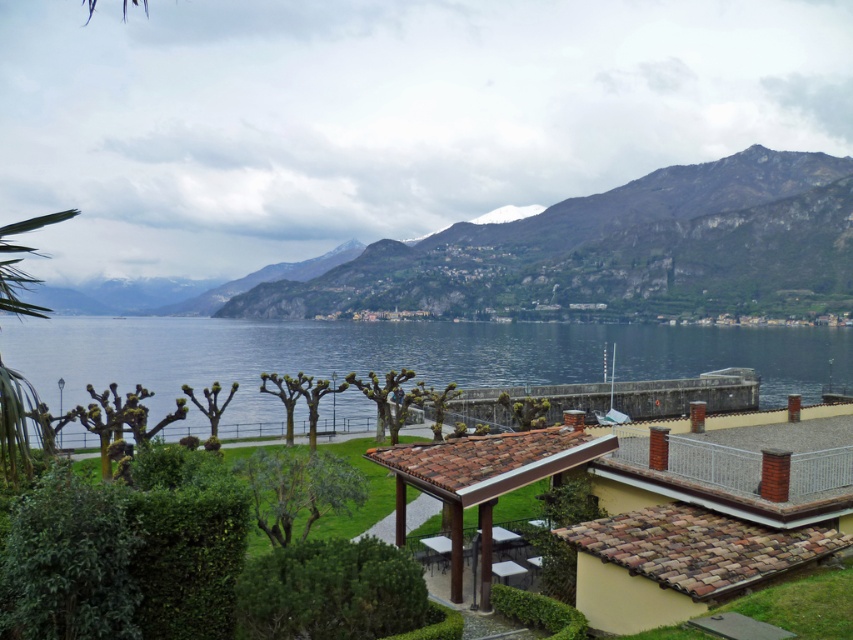
You are standing on the balcony of the building and looking out at the scene. Which object is closer to you, the green rocky mountain at upper center or the blue water at center?

The green rocky mountain at upper center is closer to you than the blue water at center because it is positioned further to the viewer according to the description.

You are standing on the balcony looking at the green rocky mountain at upper center and the blue water at center. Which object is located to the right of the other?

The green rocky mountain at upper center is positioned on the right side of blue water at center.